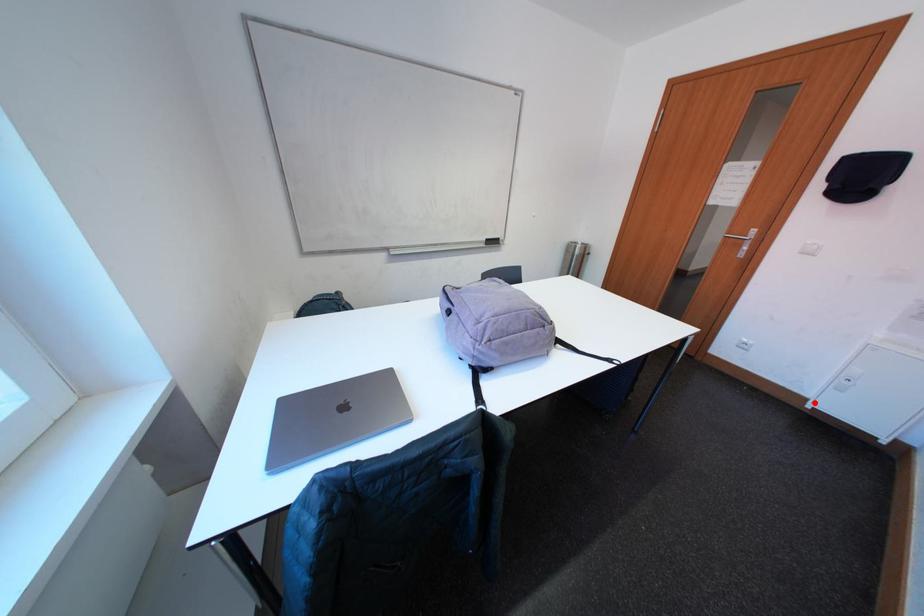
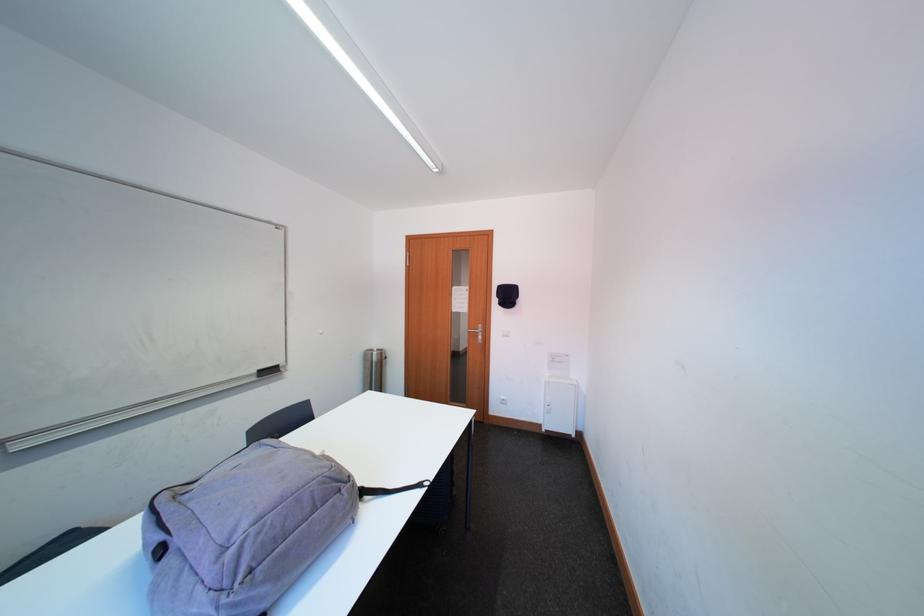
In the second image, find the point that corresponds to the highlighted location in the first image.

(551, 429)